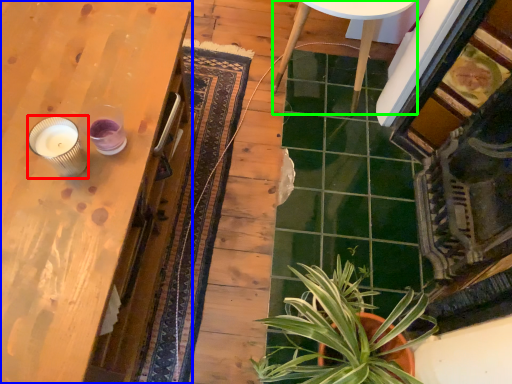
Question: Which object is the farthest from candle holder (highlighted by a red box)? Choose among these: table (highlighted by a blue box) or round table (highlighted by a green box).

Choices:
 (A) table
 (B) round table

Answer: (B)